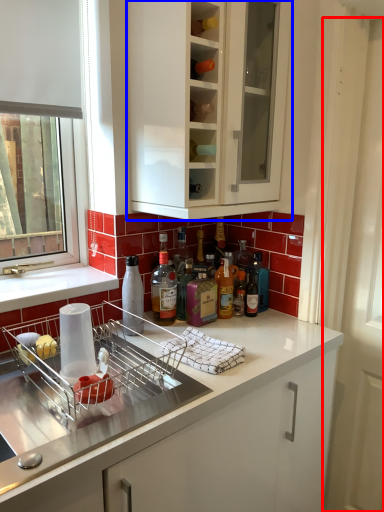
Question: Which of the following is the farthest to the observer, screen door (highlighted by a red box) or cabinetry (highlighted by a blue box)?

Choices:
 (A) screen door
 (B) cabinetry

Answer: (A)